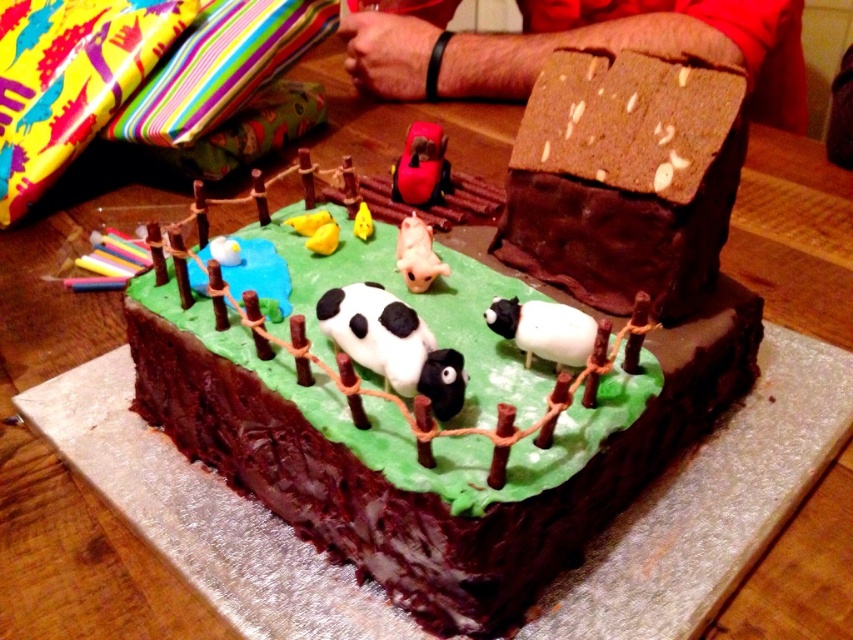
Can you confirm if black matte cow at center is positioned above white matte sheep at center?

Correct, black matte cow at center is located above white matte sheep at center.

Can you confirm if black matte cow at center is wider than white matte sheep at center?

Yes.

Identify the location of black matte cow at center. (376, 332).

Which is in front, point (624, 440) or point (432, 349)?

Point (432, 349) is in front.

At what (x,y) coordinates should I click in order to perform the action: click on chocolate cake at center. Please return your answer as a coordinate pair (x, y). The image size is (853, 640). Looking at the image, I should click on (431, 449).

At what (x,y) coordinates should I click in order to perform the action: click on chocolate cake at center. Please return your answer as a coordinate pair (x, y). The height and width of the screenshot is (640, 853). Looking at the image, I should click on (431, 449).

Is chocolate cake at center positioned before white matte sheep at center?

Yes, it is.

Is chocolate cake at center wider than white matte sheep at center?

Yes, chocolate cake at center is wider than white matte sheep at center.

What do you see at coordinates (431, 449) in the screenshot? This screenshot has height=640, width=853. I see `chocolate cake at center` at bounding box center [431, 449].

Where is `chocolate cake at center`? The height and width of the screenshot is (640, 853). chocolate cake at center is located at coordinates (431, 449).